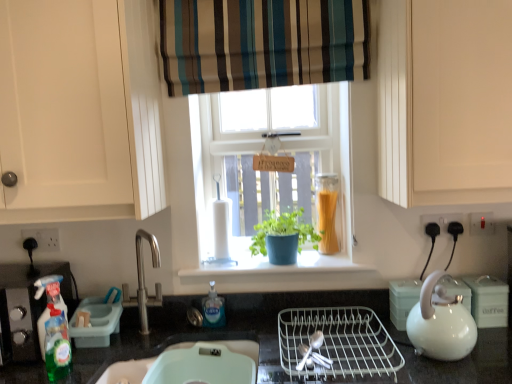
Question: Is white glossy kettle at right to the left or to the right of clear plastic bottle at lower center, positioned as the second bottle in left-to-right order, in the image?

Choices:
 (A) right
 (B) left

Answer: (A)

Question: Do you think white glossy kettle at right is within clear plastic bottle at lower center, positioned as the second bottle in left-to-right order, or outside of it?

Choices:
 (A) outside
 (B) inside

Answer: (A)

Question: Which object is positioned closest to the green plastic dish soap dispenser at left, the first appliance positioned from the left?

Choices:
 (A) white glossy teapot at right, acting as the third appliance starting from the left
 (B) striped fabric curtain at upper center
 (C) matte white sink at lower center
 (D) white glossy kettle at right
 (E) translucent plastic spray bottle at left

Answer: (E)

Question: Which is nearer to the white glossy kettle at right?

Choices:
 (A) clear plastic bottle at lower center, positioned as the second bottle in left-to-right order
 (B) green translucent bottle at lower left, acting as the first bottle starting from the front
 (C) white plastic blender at center
 (D) white glossy teapot at right, the 2th appliance in the right-to-left sequence
 (E) white plastic dish rack at lower left

Answer: (D)